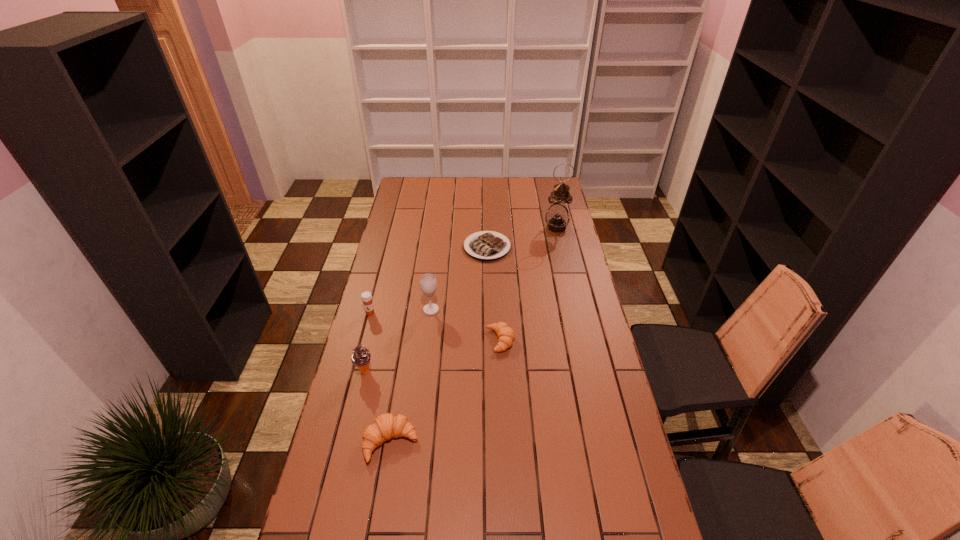
You are a GUI agent. You are given a task and a screenshot of the screen. Output one action in this format:
    pyautogui.click(x=<x>, y=<y>)
    Task: Click on the fifth shortest object
    
    Given the screenshot: What is the action you would take?
    pyautogui.click(x=361, y=358)

Identify the location of free space located on the back of the third shortest object. The height and width of the screenshot is (540, 960). (408, 338).

I want to click on vacant region located on the back of the shorter crescent roll, so click(x=497, y=287).

This screenshot has width=960, height=540. Find the location of `free spot located 0.120m on the front of the tallest object`. free spot located 0.120m on the front of the tallest object is located at coordinates (562, 249).

This screenshot has width=960, height=540. In order to click on free space located 0.120m on the front of the wineglass in this screenshot , I will do [427, 339].

The height and width of the screenshot is (540, 960). In order to click on vacant point located 0.250m on the label side of the fourth tallest object in this screenshot , I will do pyautogui.click(x=355, y=369).

Find the location of a particular element. vacant point located on the front of the shortest object is located at coordinates (489, 314).

Locate an element on the screen. The width and height of the screenshot is (960, 540). free space located 0.390m on the right of the icecream is located at coordinates [x=487, y=372].

Identify the location of crescent roll that is at the left edge. (386, 426).

Where is `medicine at the left edge`? medicine at the left edge is located at coordinates [x=366, y=296].